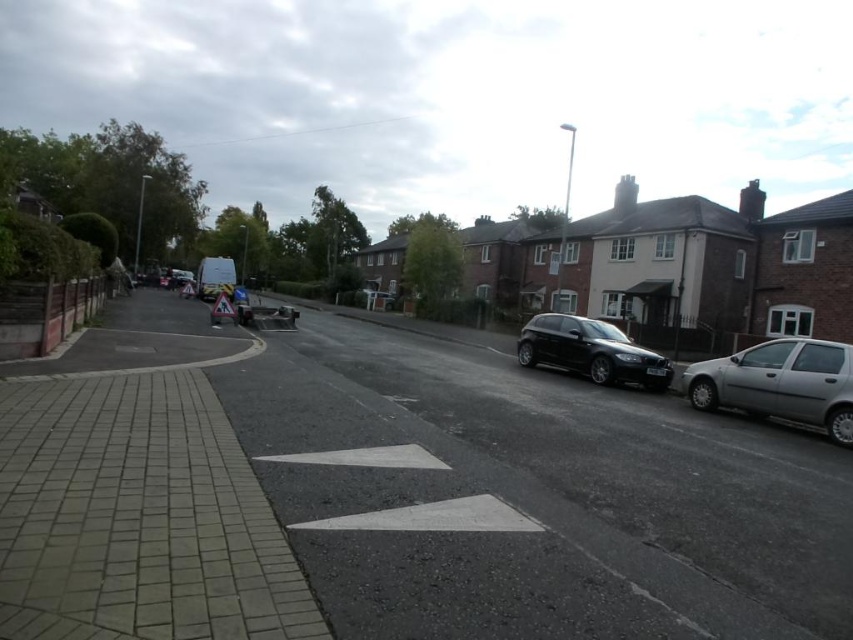
Between silver metallic hatchback at right and shiny black hatchback at center, which one is positioned higher?

shiny black hatchback at center is higher up.

Between point (825, 428) and point (643, 365), which one is positioned in front?

Point (825, 428) is more forward.

Where is `silver metallic hatchback at right`? silver metallic hatchback at right is located at coordinates (780, 384).